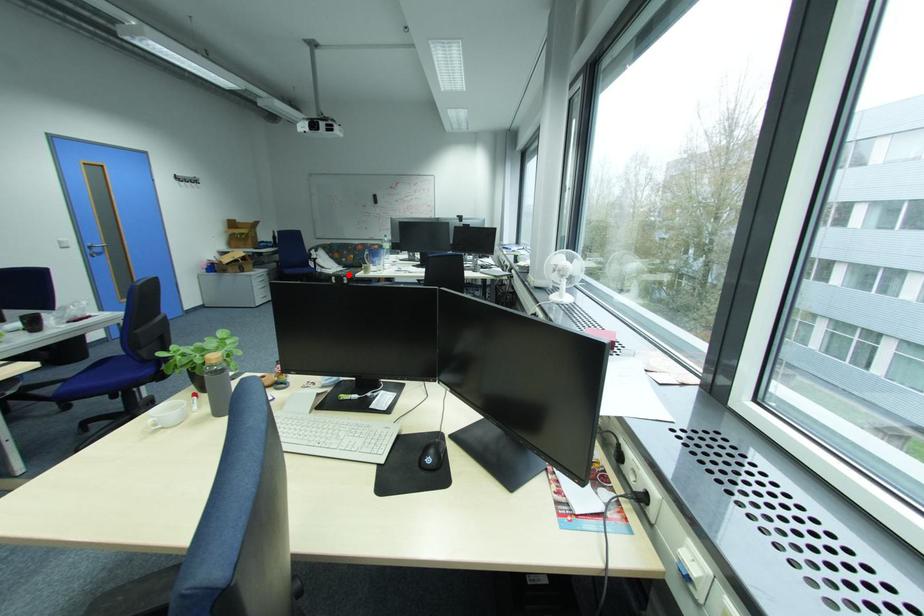
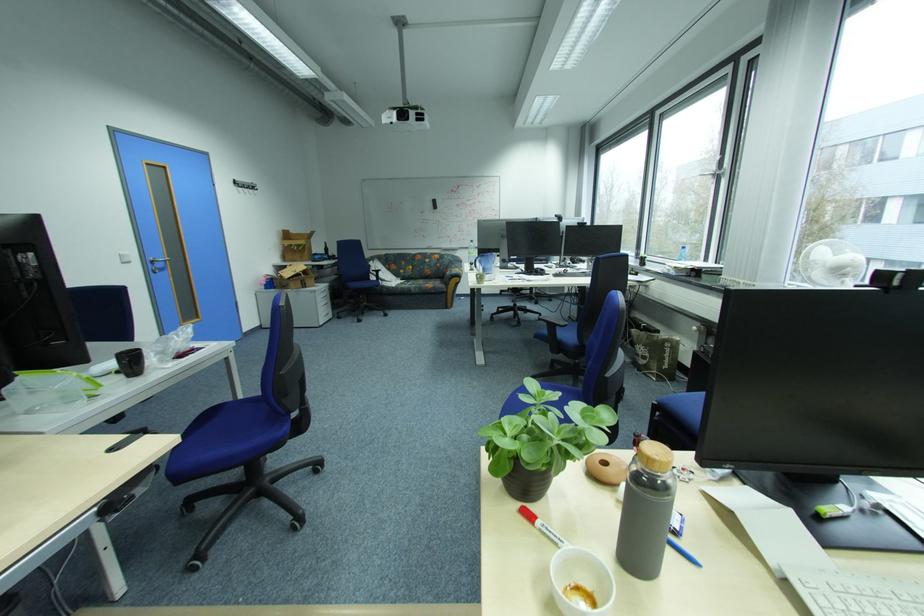
In the second image, find the point that corresponds to the highlighted location in the first image.

(411, 286)